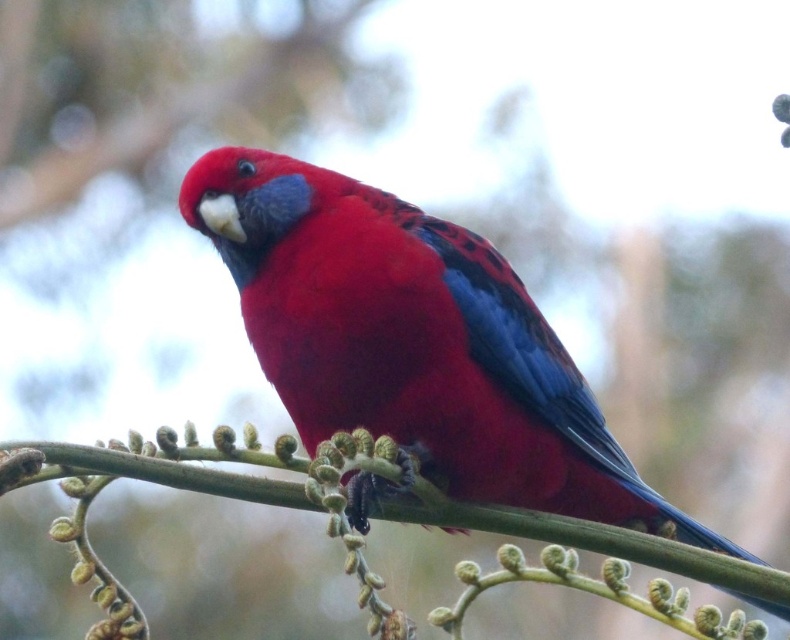
Question: Is matte red parrot at center to the right of green textured branch at center from the viewer's perspective?

Choices:
 (A) yes
 (B) no

Answer: (A)

Question: Does matte red parrot at center appear on the left side of green textured branch at center?

Choices:
 (A) no
 (B) yes

Answer: (A)

Question: Which of the following is the closest to the observer?

Choices:
 (A) matte red parrot at center
 (B) green textured branch at center

Answer: (B)

Question: Is matte red parrot at center smaller than green textured branch at center?

Choices:
 (A) yes
 (B) no

Answer: (B)

Question: Which point is closer to the camera taking this photo?

Choices:
 (A) (785, 593)
 (B) (557, 392)

Answer: (A)